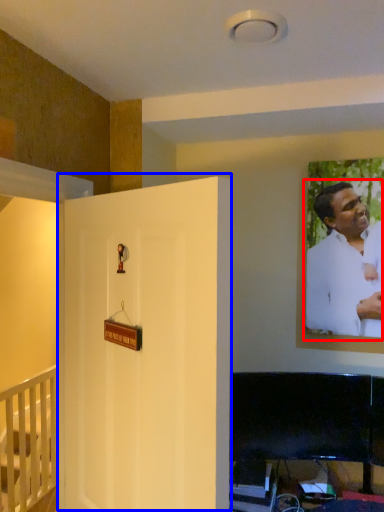
Question: Which object appears farthest to the camera in this image, man (highlighted by a red box) or door (highlighted by a blue box)?

Choices:
 (A) man
 (B) door

Answer: (A)